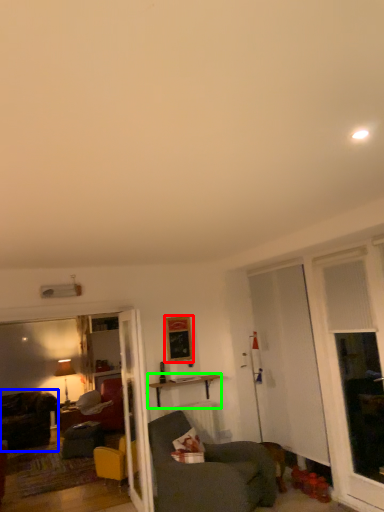
Question: Which object is the farthest from picture frame (highlighted by a red box)? Choose among these: chair (highlighted by a blue box) or table (highlighted by a green box).

Choices:
 (A) chair
 (B) table

Answer: (A)